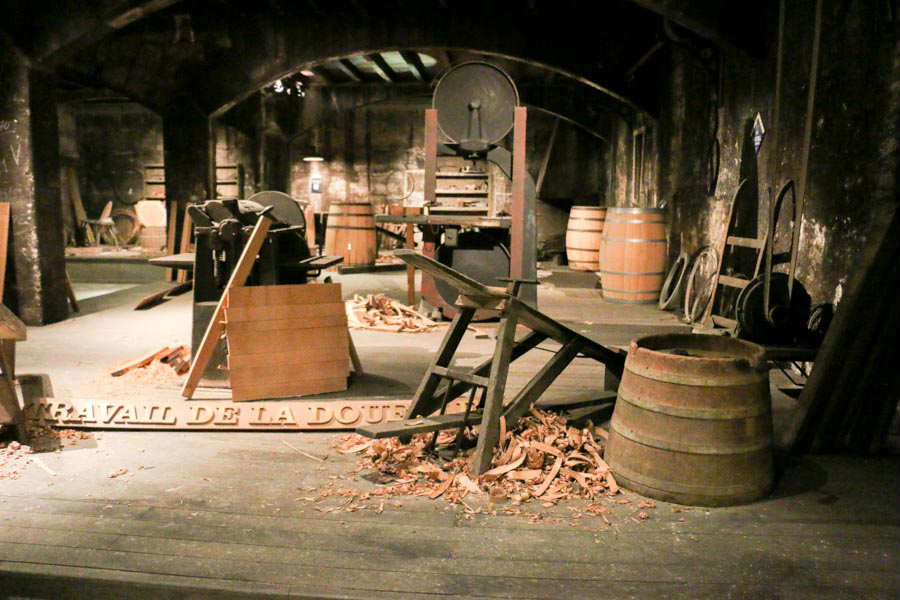
At what (x,y) coordinates should I click in order to perform the action: click on wooden board. Please return your answer as a coordinate pair (x, y). This screenshot has height=600, width=900. Looking at the image, I should click on (246, 258).